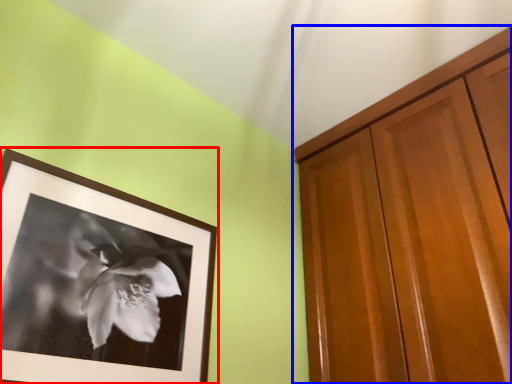
Question: Which point is further to the camera, picture frame (highlighted by a red box) or cabinetry (highlighted by a blue box)?

Choices:
 (A) picture frame
 (B) cabinetry

Answer: (B)